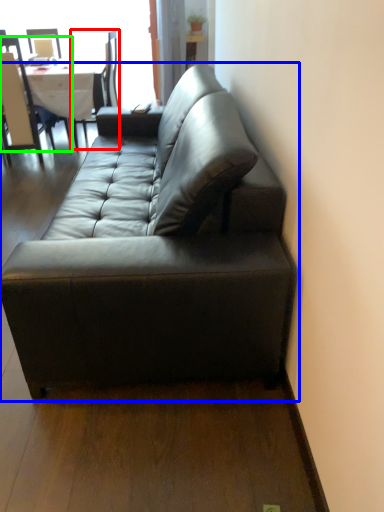
Question: Which is farther away from chair (highlighted by a red box)? studio couch (highlighted by a blue box) or chair (highlighted by a green box)?

Choices:
 (A) studio couch
 (B) chair

Answer: (A)